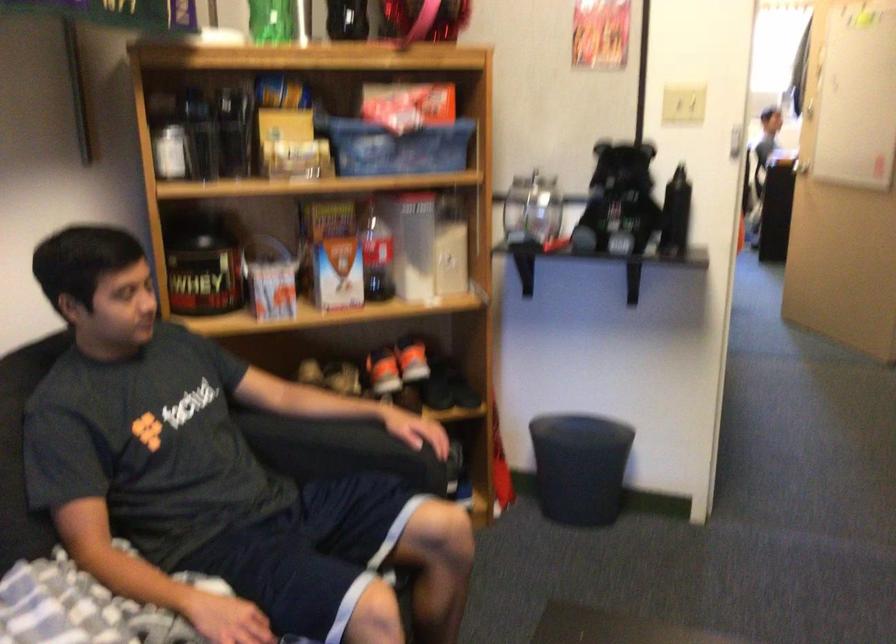
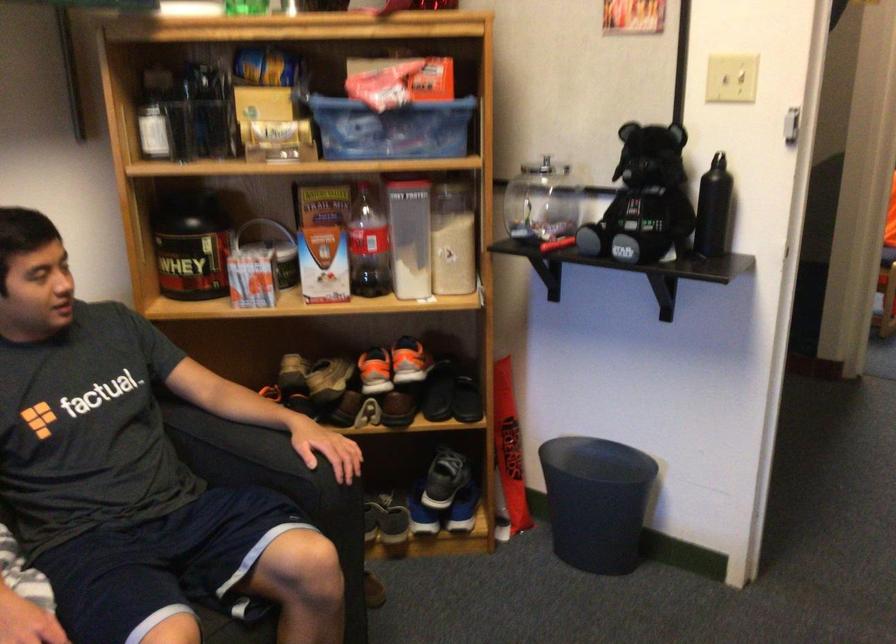
Where in the second image is the point corresponding to pixel 380 254 from the first image?

(367, 245)